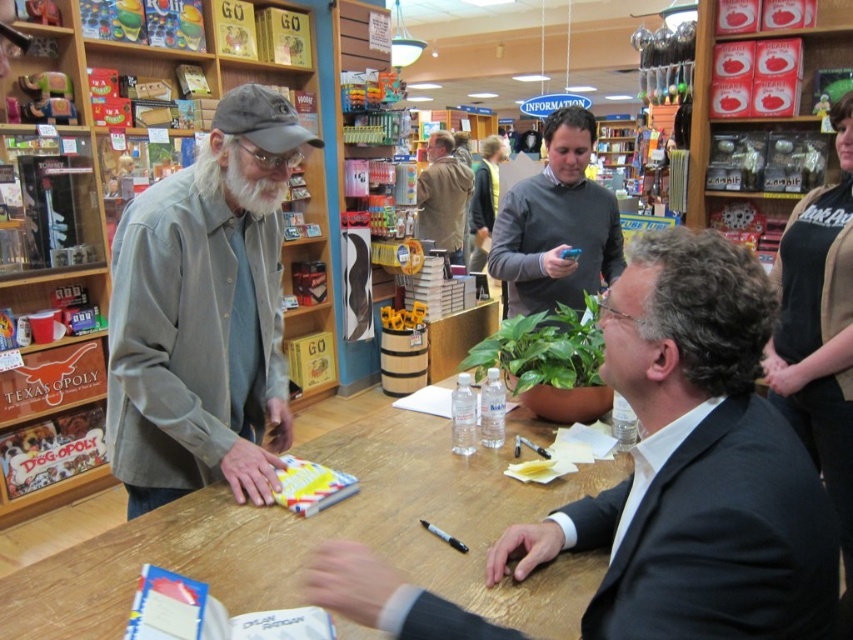
You are a customer in the store and want to approach the person wearing the dark gray sweater at center to ask a question. Which direction should you move relative to the black cotton shirt at upper right?

The black cotton shirt at upper right is below the dark gray sweater at center, so you should move upward from the black cotton shirt at upper right to reach the dark gray sweater at center.

You are a customer in the store and want to place an item on the wooden table at center. Where should you position yourself relative to the black cotton shirt at upper right to do so?

The wooden table at center is below the black cotton shirt at upper right, so you should position yourself below the black cotton shirt at upper right to place the item on the wooden table at center.

You are a customer in the store and want to know which of the two items is closer to the ceiling. The items are the black cotton shirt at upper right and the dark gray sweater at center. Can you determine which one is closer?

The black cotton shirt at upper right is shorter than the dark gray sweater at center, so the dark gray sweater at center is taller and closer to the ceiling.